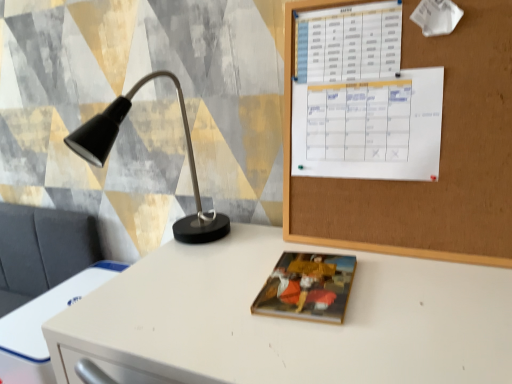
The height and width of the screenshot is (384, 512). I want to click on free space in front of matte paper book at center, so click(298, 344).